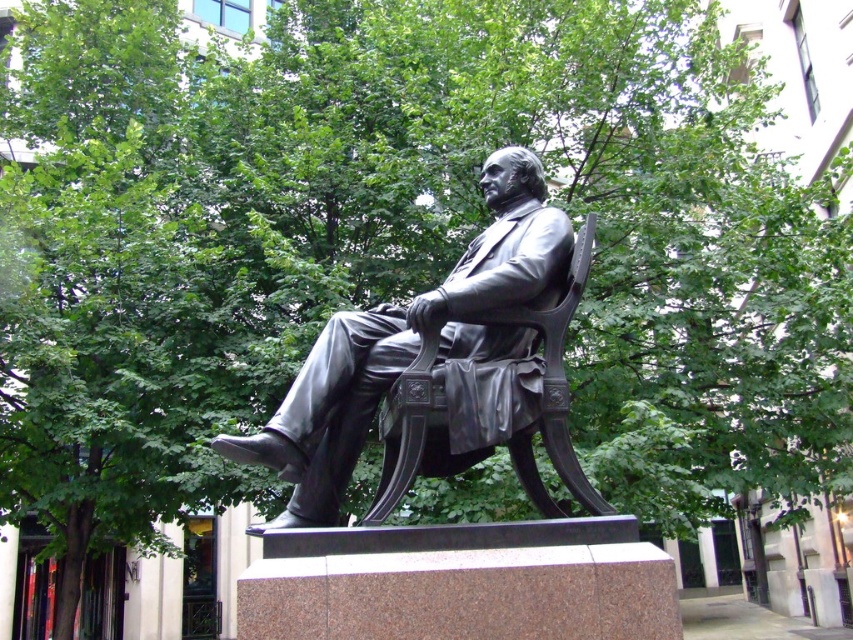
Who is more forward, (511, 387) or (399, 483)?

Point (399, 483) is in front.

Between point (384, 387) and point (535, 321), which one is positioned behind?

Point (535, 321)

Based on the photo, who is more forward, (498,416) or (527,438)?

Point (498,416)

Find the location of `polished bronze statue at center`. polished bronze statue at center is located at coordinates (403, 342).